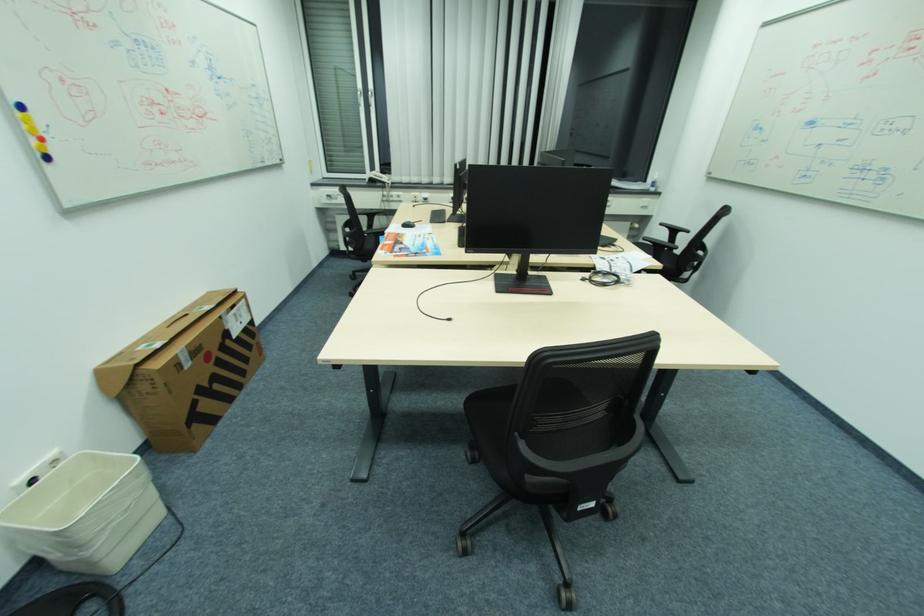
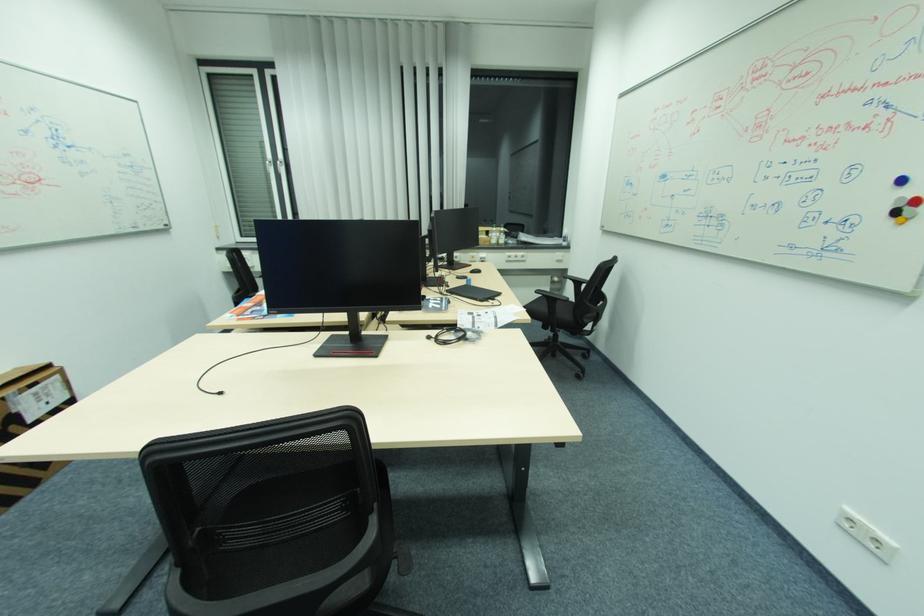
Question: The images are taken continuously from a first-person perspective. In which direction are you moving?

Choices:
 (A) Left
 (B) Right
 (C) Forward
 (D) Backward

Answer: (B)